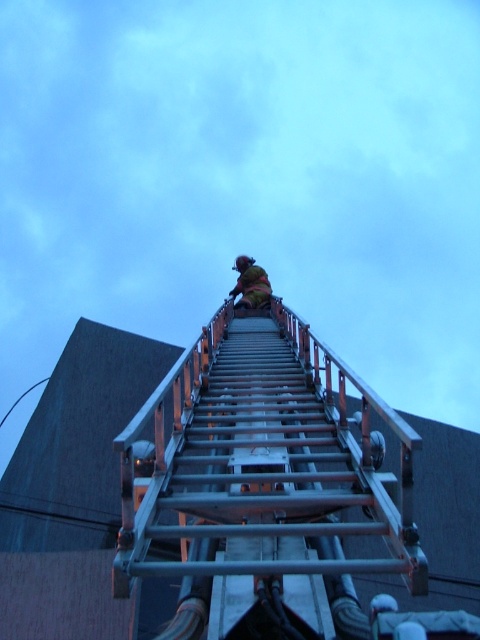
Does point (357, 632) come behind point (236, 260)?

No, it is in front of (236, 260).

How far apart are metallic silver ladder at upper center and yellow fabric at upper center?

They are 37.57 feet apart.

The image size is (480, 640). Describe the element at coordinates (263, 476) in the screenshot. I see `metallic silver ladder at upper center` at that location.

Find the location of a particular element. metallic silver ladder at upper center is located at coordinates (263, 476).